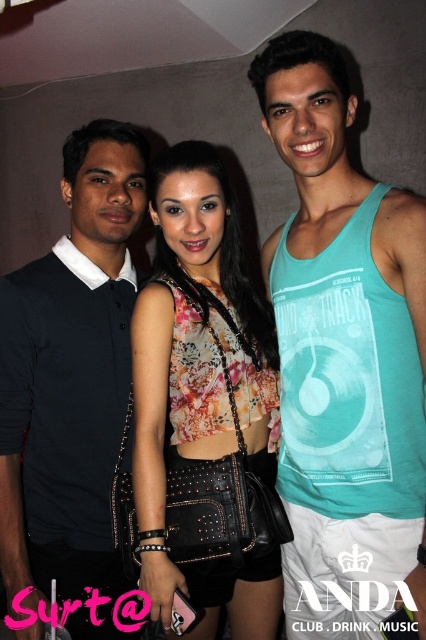
Does point (414, 433) lie behind point (78, 221)?

No, (414, 433) is closer to viewer.

Does teal tank top at center appear under black matte shirt at left?

No.

Find the location of a particular element. The image size is (426, 640). teal tank top at center is located at coordinates (344, 356).

Is teal tank top at center to the right of floral fabric top at center from the viewer's perspective?

Yes, teal tank top at center is to the right of floral fabric top at center.

Which is behind, point (423, 531) or point (210, 337)?

Point (210, 337)

What do you see at coordinates (344, 356) in the screenshot?
I see `teal tank top at center` at bounding box center [344, 356].

Locate an element on the screen. The image size is (426, 640). teal tank top at center is located at coordinates (344, 356).

Can you confirm if black matte shirt at left is positioned above floral fabric top at center?

Indeed, black matte shirt at left is positioned over floral fabric top at center.

Can you confirm if black matte shirt at left is smaller than floral fabric top at center?

Yes.

Describe the element at coordinates (71, 372) in the screenshot. I see `black matte shirt at left` at that location.

Locate an element on the screen. This screenshot has height=640, width=426. black matte shirt at left is located at coordinates (71, 372).